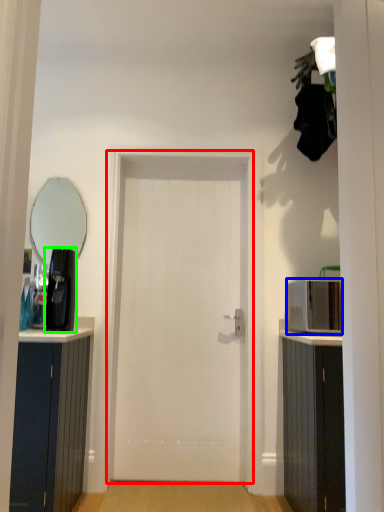
Question: Which is farther away from door (highlighted by a red box)? appliance (highlighted by a blue box) or coffee machine (highlighted by a green box)?

Choices:
 (A) appliance
 (B) coffee machine

Answer: (A)